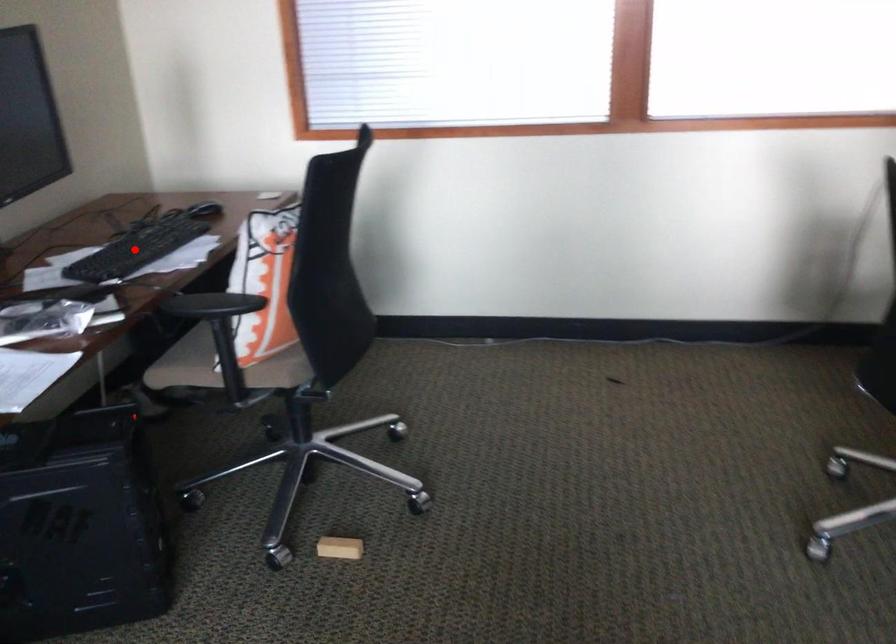
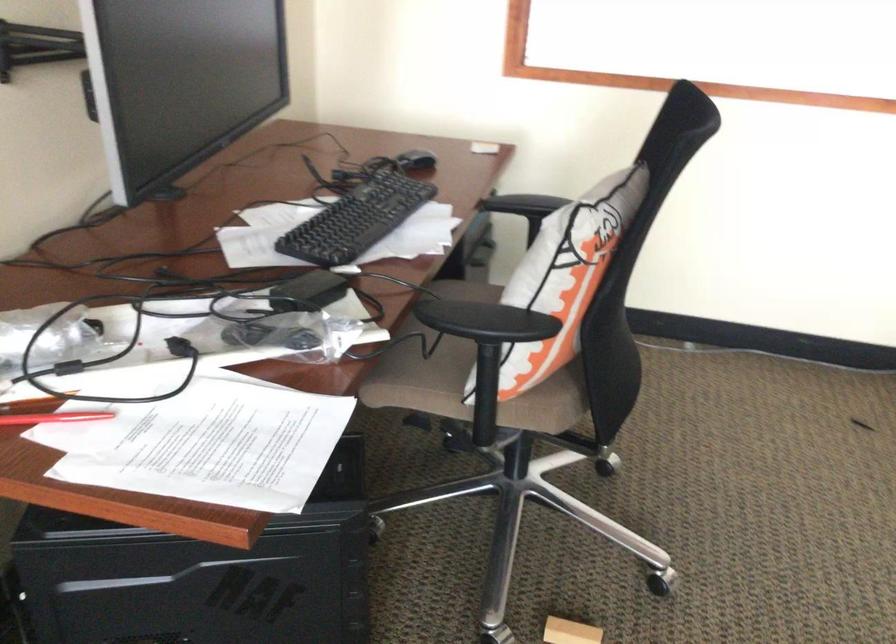
Question: I am providing you with two images of the same scene from different viewpoints. Given a red point in image1, look at the same physical point in image2. Is it:

Choices:
 (A) Closer to the viewpoint
 (B) Farther from the viewpoint

Answer: (A)